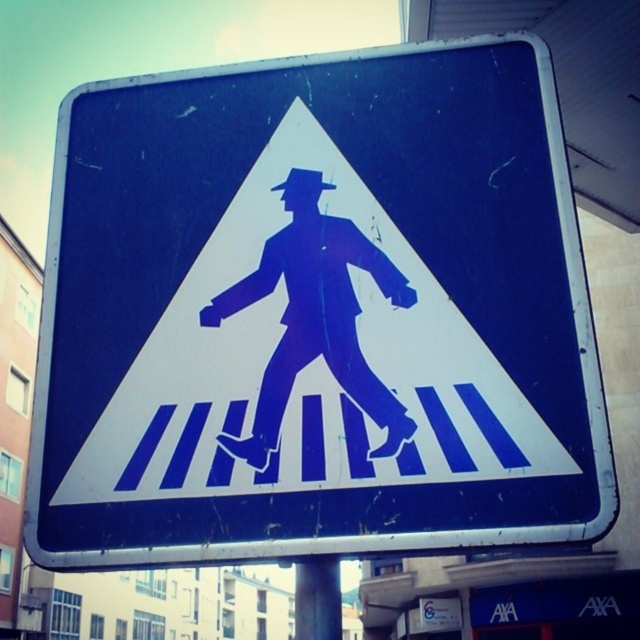
Question: Does blue matte pedestrian at center have a smaller size compared to metallic gray pole at lower center?

Choices:
 (A) no
 (B) yes

Answer: (B)

Question: Which of the following is the farthest from the observer?

Choices:
 (A) metallic gray pole at lower center
 (B) blue matte pedestrian at center

Answer: (A)

Question: Which object is closer to the camera taking this photo?

Choices:
 (A) blue matte pedestrian at center
 (B) metallic gray pole at lower center

Answer: (A)

Question: Which of the following is the farthest from the observer?

Choices:
 (A) (304, 600)
 (B) (282, 371)

Answer: (B)

Question: Is blue matte pedestrian at center above metallic gray pole at lower center?

Choices:
 (A) no
 (B) yes

Answer: (B)

Question: Is blue matte pedestrian at center above metallic gray pole at lower center?

Choices:
 (A) yes
 (B) no

Answer: (A)